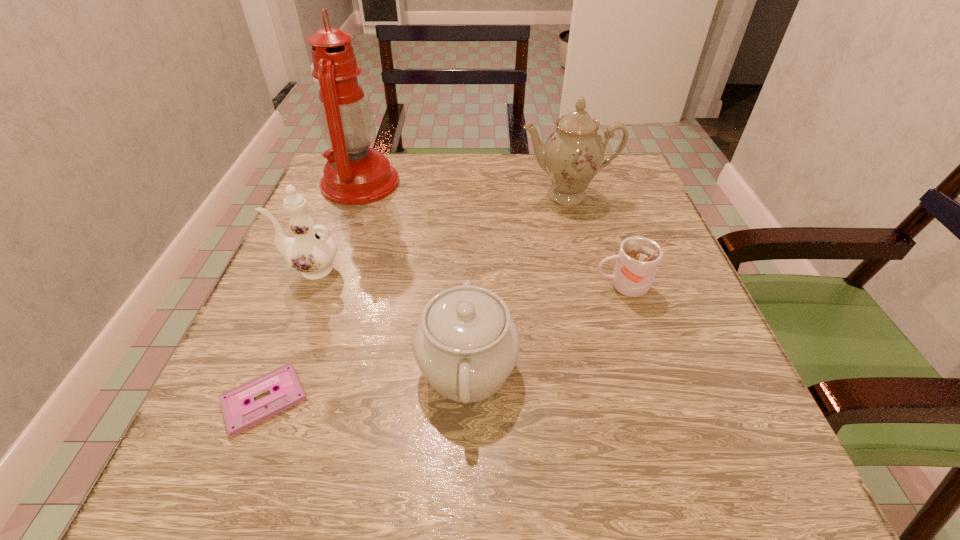
Locate an element on the screen. oil lamp is located at coordinates (354, 174).

Locate an element on the screen. Image resolution: width=960 pixels, height=540 pixels. the farthest chinaware is located at coordinates pos(573,154).

The height and width of the screenshot is (540, 960). Identify the location of the tallest chinaware. (573, 154).

This screenshot has height=540, width=960. I want to click on the leftmost chinaware, so click(312, 251).

At what (x,y) coordinates should I click in order to perform the action: click on the second nearest chinaware. Please return your answer as a coordinate pair (x, y). Looking at the image, I should click on (312, 251).

Image resolution: width=960 pixels, height=540 pixels. In order to click on the shortest chinaware in this screenshot , I will do `click(466, 345)`.

Identify the location of the second chinaware from left to right. This screenshot has height=540, width=960. (466, 345).

Locate an element on the screen. The width and height of the screenshot is (960, 540). the fifth tallest object is located at coordinates (637, 262).

Find the location of a particular element. This screenshot has height=540, width=960. videotape is located at coordinates (239, 415).

Where is `vacant area situated on the right of the tallest object`? The width and height of the screenshot is (960, 540). vacant area situated on the right of the tallest object is located at coordinates (423, 183).